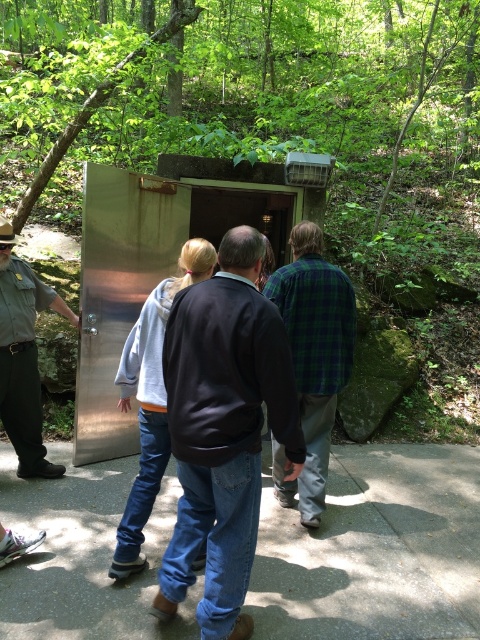
You are a photographer trying to capture a group photo of the dark blue sweater at center and the green plaid shirt at center. Since you want both subjects to appear equally tall in the photo, which subject should you position closer to the camera?

The dark blue sweater at center is shorter than the green plaid shirt at center. To make them appear the same height in the photo, position the dark blue sweater at center closer to the camera than the green plaid shirt at center.

You are a visitor trying to locate the park ranger in the forest scene. You see a dark blue sweater at center and a brushed metal uniform at left. Which object is closer to the entrance of the bunker?

The dark blue sweater at center is to the right of the brushed metal uniform at left, so the brushed metal uniform at left is closer to the entrance of the bunker.

You are trying to determine who is taller between the person in the dark blue sweater at center and the person in the brushed metal uniform at left. Based on the scene, which one is shorter?

The dark blue sweater at center is not as tall as the brushed metal uniform at left, so the person in the dark blue sweater at center is shorter.